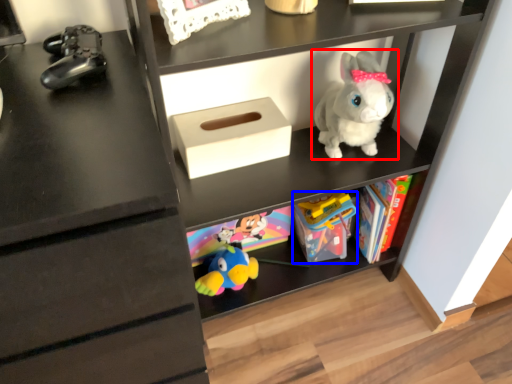
Question: Which object is further to the camera taking this photo, toy (highlighted by a red box) or toy (highlighted by a blue box)?

Choices:
 (A) toy
 (B) toy

Answer: (B)